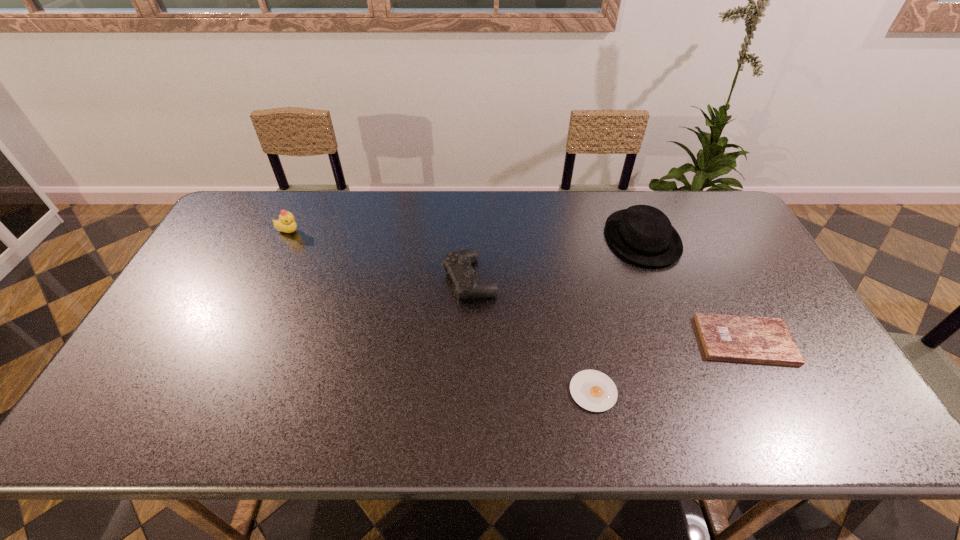
Image resolution: width=960 pixels, height=540 pixels. Identify the location of empty space between the fedora and the duckling. (466, 235).

I want to click on free space between the shortest object and the fedora, so click(x=617, y=315).

Where is `the closest object relative to the duckling`? This screenshot has width=960, height=540. the closest object relative to the duckling is located at coordinates (458, 264).

I want to click on object that is the fourth closest to the control, so [x=764, y=340].

Where is `vacant area that satisfies the following two spatial constraints: 1. on the front-facing side of the third object from right to left; 2. on the left side of the duckling`? The height and width of the screenshot is (540, 960). vacant area that satisfies the following two spatial constraints: 1. on the front-facing side of the third object from right to left; 2. on the left side of the duckling is located at coordinates (214, 392).

Where is `vacant region that satisfies the following two spatial constraints: 1. on the front-facing side of the egg yolk; 2. on the right side of the duckling`? vacant region that satisfies the following two spatial constraints: 1. on the front-facing side of the egg yolk; 2. on the right side of the duckling is located at coordinates (214, 392).

Find the location of a particular element. The image size is (960, 540). free space that satisfies the following two spatial constraints: 1. on the front-facing side of the leftmost object; 2. on the back side of the fedora is located at coordinates (285, 238).

Where is `vacant area that satisfies the following two spatial constraints: 1. on the back side of the third object from right to left; 2. on the front-facing side of the duckling`? The height and width of the screenshot is (540, 960). vacant area that satisfies the following two spatial constraints: 1. on the back side of the third object from right to left; 2. on the front-facing side of the duckling is located at coordinates (562, 232).

I want to click on vacant space that satisfies the following two spatial constraints: 1. on the front-facing side of the leftmost object; 2. on the left side of the Bible, so click(x=238, y=340).

Locate an element on the screen. The image size is (960, 540). vacant area that satisfies the following two spatial constraints: 1. on the front-facing side of the duckling; 2. on the right side of the third shortest object is located at coordinates (266, 279).